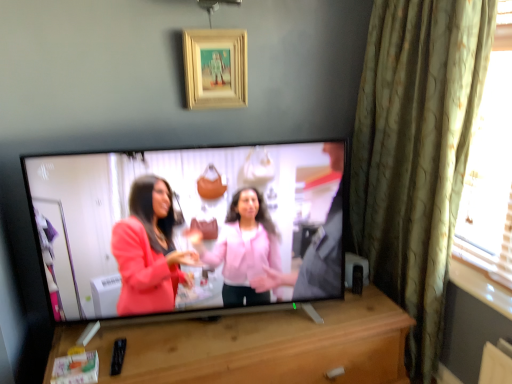
At what (x,y) coordinates should I click in order to perform the action: click on wooden cabinet at center. Please return your answer as a coordinate pair (x, y). The image size is (512, 384). Looking at the image, I should click on (265, 345).

Measure the distance between point (250, 304) and camera.

Point (250, 304) is 6.10 feet from camera.

Identify the location of wooden picture frame at upper center. The width and height of the screenshot is (512, 384). (215, 68).

Is matte black tv at center turned away from green textured curtain at right?

No, matte black tv at center is not facing the opposite direction of green textured curtain at right.

Looking at this image, which of these two, matte black tv at center or green textured curtain at right, stands shorter?

Standing shorter between the two is matte black tv at center.

Considering the positions of points (76, 252) and (451, 142), is point (76, 252) closer to camera compared to point (451, 142)?

That is False.

Measure the distance between wooden picture frame at upper center and green textured curtain at right.

wooden picture frame at upper center and green textured curtain at right are 80.48 centimeters apart from each other.

Does wooden picture frame at upper center appear on the left side of green textured curtain at right?

Indeed, wooden picture frame at upper center is positioned on the left side of green textured curtain at right.

Is wooden picture frame at upper center oriented away from green textured curtain at right?

No, green textured curtain at right is not at the back of wooden picture frame at upper center.

Is point (247, 99) closer to viewer compared to point (436, 9)?

No, (247, 99) is further to viewer.

From the picture: How many degrees apart are the facing directions of green textured curtain at right and matte black tv at center?

The angular difference between green textured curtain at right and matte black tv at center is 77 degrees.

Find the location of a particular element. curtain above the matte black tv at center (from the image's perspective) is located at coordinates (416, 153).

In the scene shown: Who is smaller, green textured curtain at right or matte black tv at center?

matte black tv at center.

Is green textured curtain at right not inside matte black tv at center?

That's correct, green textured curtain at right is outside of matte black tv at center.

Which is in front, wooden cabinet at center or green textured curtain at right?

Positioned in front is wooden cabinet at center.

From a real-world perspective, is wooden cabinet at center beneath green textured curtain at right?

Correct, in the physical world, wooden cabinet at center is lower than green textured curtain at right.

From their relative heights in the image, would you say wooden cabinet at center is taller or shorter than green textured curtain at right?

Considering their sizes, wooden cabinet at center has less height than green textured curtain at right.

Considering the sizes of wooden cabinet at center and green textured curtain at right in the image, is wooden cabinet at center wider or thinner than green textured curtain at right?

wooden cabinet at center is wider than green textured curtain at right.

Is green textured curtain at right further to the viewer compared to wooden picture frame at upper center?

No, it is not.

Are green textured curtain at right and wooden picture frame at upper center far apart?

They are positioned close to each other.

How different are the orientations of green textured curtain at right and wooden picture frame at upper center in degrees?

They differ by 90.5 degrees in their facing directions.

Does point (159, 365) come farther from viewer compared to point (185, 43)?

No, it is in front of (185, 43).

Is there a large distance between wooden cabinet at center and wooden picture frame at upper center?

Yes.

Considering the sizes of objects wooden cabinet at center and wooden picture frame at upper center in the image provided, who is thinner, wooden cabinet at center or wooden picture frame at upper center?

wooden picture frame at upper center is thinner.

Does wooden picture frame at upper center have a lesser width compared to matte black tv at center?

Indeed, wooden picture frame at upper center has a lesser width compared to matte black tv at center.

Is wooden picture frame at upper center not within matte black tv at center?

wooden picture frame at upper center is positioned outside matte black tv at center.

From the image's perspective, is wooden picture frame at upper center above or below matte black tv at center?

From the image's perspective, wooden picture frame at upper center appears above matte black tv at center.

From a real-world perspective, is wooden picture frame at upper center over matte black tv at center?

Yes, from a real-world perspective, wooden picture frame at upper center is on top of matte black tv at center.

The image size is (512, 384). I want to click on television lying below the green textured curtain at right (from the image's perspective), so click(188, 228).

The height and width of the screenshot is (384, 512). I want to click on curtain on the right side of wooden picture frame at upper center, so click(x=416, y=153).

Based on their spatial positions, is wooden cabinet at center or wooden picture frame at upper center further from matte black tv at center?

wooden picture frame at upper center lies further to matte black tv at center than the other object.

Based on their spatial positions, is wooden cabinet at center or wooden picture frame at upper center closer to green textured curtain at right?

wooden cabinet at center is positioned closer to the anchor green textured curtain at right.

Which object lies nearer to the anchor point wooden picture frame at upper center, matte black tv at center or green textured curtain at right?

matte black tv at center lies closer to wooden picture frame at upper center than the other object.

Considering their positions, is wooden cabinet at center positioned further to matte black tv at center than green textured curtain at right?

Based on the image, green textured curtain at right appears to be further to matte black tv at center.

Estimate the real-world distances between objects in this image. Which object is closer to wooden picture frame at upper center, wooden cabinet at center or green textured curtain at right?

green textured curtain at right is positioned closer to the anchor wooden picture frame at upper center.

Based on the photo, looking at the image, which one is located further to green textured curtain at right, wooden cabinet at center or matte black tv at center?

Based on the image, wooden cabinet at center appears to be further to green textured curtain at right.

Based on their spatial positions, is wooden picture frame at upper center or green textured curtain at right further from wooden cabinet at center?

Among the two, wooden picture frame at upper center is located further to wooden cabinet at center.

Looking at the image, which one is located further to green textured curtain at right, wooden picture frame at upper center or wooden cabinet at center?

wooden picture frame at upper center lies further to green textured curtain at right than the other object.

Where is `curtain that lies between wooden picture frame at upper center and wooden cabinet at center from top to bottom`? This screenshot has width=512, height=384. curtain that lies between wooden picture frame at upper center and wooden cabinet at center from top to bottom is located at coordinates (416, 153).

This screenshot has width=512, height=384. I want to click on picture frame between matte black tv at center and green textured curtain at right from left to right, so click(215, 68).

You are a GUI agent. You are given a task and a screenshot of the screen. Output one action in this format:
    pyautogui.click(x=<x>, y=<y>)
    Task: Click on the television between wooden picture frame at upper center and wooden cabinet at center vertically
    Image resolution: width=512 pixels, height=384 pixels.
    Given the screenshot: What is the action you would take?
    pyautogui.click(x=188, y=228)

Find the location of `furniture located between matte black tv at center and green textured curtain at right in the left-right direction`. furniture located between matte black tv at center and green textured curtain at right in the left-right direction is located at coordinates (265, 345).